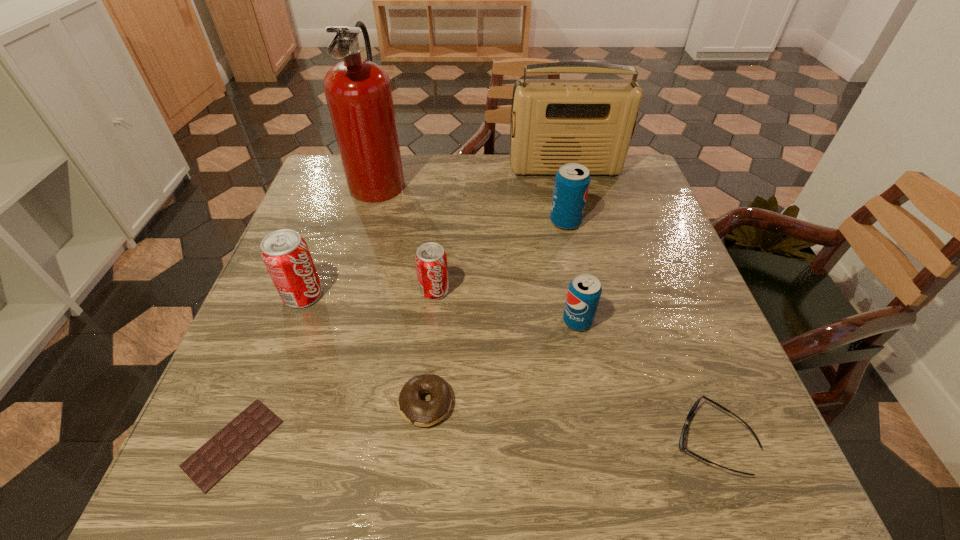
Find the location of a particular element. The width and height of the screenshot is (960, 540). the smaller blue soda can is located at coordinates (584, 292).

At what (x,y) coordinates should I click in order to perform the action: click on doughnut. Please return your answer as a coordinate pair (x, y). The height and width of the screenshot is (540, 960). Looking at the image, I should click on (412, 408).

Where is `blue sunglasses`? The width and height of the screenshot is (960, 540). blue sunglasses is located at coordinates (681, 442).

This screenshot has height=540, width=960. In order to click on the shortest object in this screenshot , I will do `click(218, 456)`.

Locate an element on the screen. The width and height of the screenshot is (960, 540). brown chocolate bar is located at coordinates (218, 456).

This screenshot has height=540, width=960. Identify the location of blank area located 0.400m with the handle and nozzle on the tallest object. (545, 179).

You are a GUI agent. You are given a task and a screenshot of the screen. Output one action in this format:
    pyautogui.click(x=<x>, y=<y>)
    Task: Click on the blank space located 0.150m on the front-facing side of the second tallest object
    
    Given the screenshot: What is the action you would take?
    pyautogui.click(x=576, y=211)

The image size is (960, 540). What are the coordinates of `vacant space situated 0.110m on the back of the farthest soda can` in the screenshot? It's located at (559, 188).

Where is `vacant space situated 0.290m on the front of the leftmost soda can`? The image size is (960, 540). vacant space situated 0.290m on the front of the leftmost soda can is located at coordinates (247, 446).

You are a GUI agent. You are given a task and a screenshot of the screen. Output one action in this format:
    pyautogui.click(x=<x>, y=<y>)
    Task: Click on the free space located 0.350m on the right of the third soda can from right to left
    This screenshot has width=960, height=540.
    Given the screenshot: What is the action you would take?
    pyautogui.click(x=609, y=291)